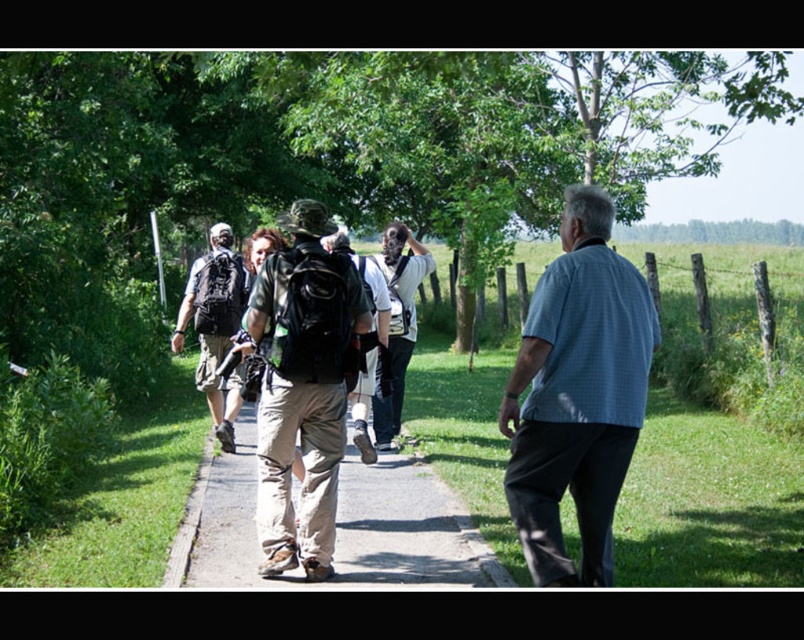
Question: Which point is closer to the camera?

Choices:
 (A) blue checkered shirt at right
 (B) matte black backpack at left
 (C) light gray concrete pavement at center
 (D) white shirt at center

Answer: (A)

Question: Is blue checkered shirt at right wider than matte black backpack at left?

Choices:
 (A) yes
 (B) no

Answer: (B)

Question: Does khaki cotton pants at center appear on the right side of white shirt at center?

Choices:
 (A) no
 (B) yes

Answer: (A)

Question: Which object appears farthest from the camera in this image?

Choices:
 (A) blue checkered shirt at right
 (B) light gray concrete pavement at center

Answer: (B)

Question: Does matte black backpack at left come behind white shirt at center?

Choices:
 (A) yes
 (B) no

Answer: (A)

Question: Which point is farther to the camera?

Choices:
 (A) (614, 308)
 (B) (243, 497)
 (C) (236, 316)
 (D) (337, 436)

Answer: (C)